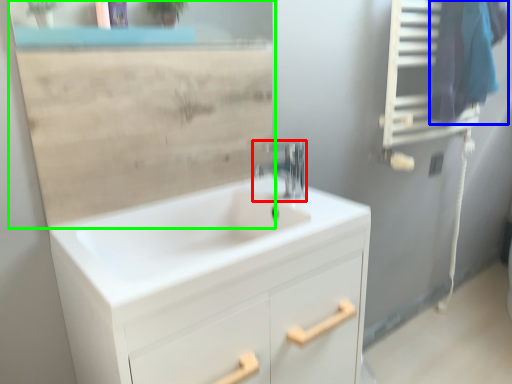
Question: Considering the real-world distances, which object is closest to tap (highlighted by a red box)? laundry (highlighted by a blue box) or mirror (highlighted by a green box).

Choices:
 (A) laundry
 (B) mirror

Answer: (B)